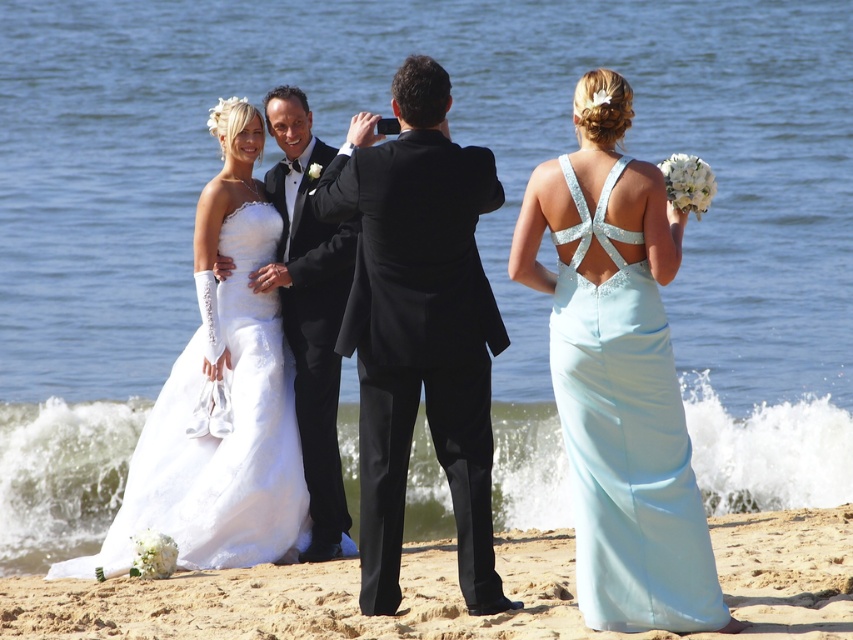
Question: Which point appears farthest from the camera in this image?

Choices:
 (A) (764, 636)
 (B) (399, 156)

Answer: (B)

Question: Which of the following is the closest to the observer?

Choices:
 (A) (488, 333)
 (B) (107, 620)
 (C) (277, 166)
 (D) (640, 225)

Answer: (D)

Question: In this image, where is black satin suit at center located relative to sandy beach at lower center?

Choices:
 (A) below
 (B) above

Answer: (B)

Question: Is sandy beach at lower center below matte white gown at center?

Choices:
 (A) no
 (B) yes

Answer: (B)

Question: Which point is closer to the camera?

Choices:
 (A) light blue satin dress at right
 (B) black satin tuxedo at center
 (C) sandy beach at lower center
 (D) matte white gown at center

Answer: (A)

Question: Where is sandy beach at lower center located in relation to black satin tuxedo at center in the image?

Choices:
 (A) below
 (B) above

Answer: (A)